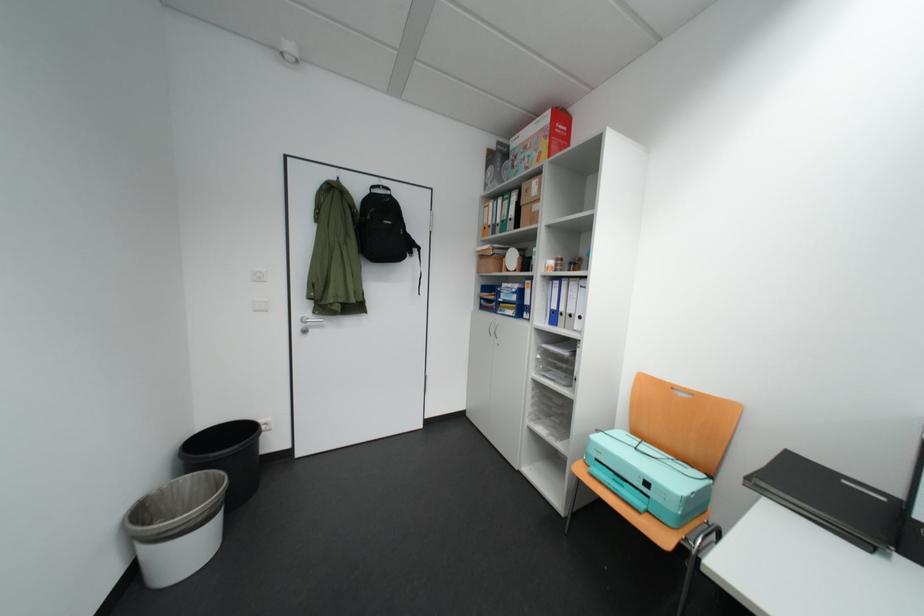
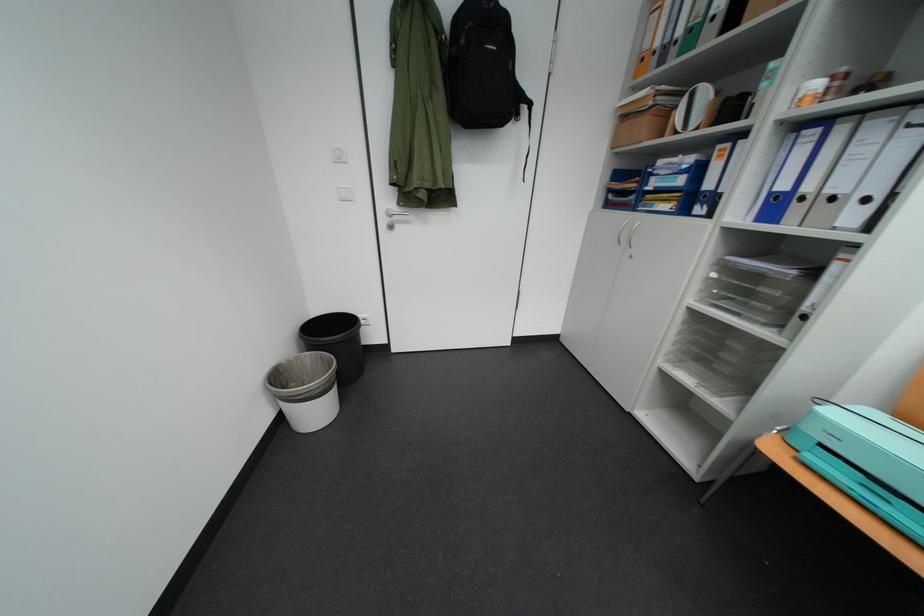
Where in the second image is the point corresponding to pixel 201 556 from the first image?

(329, 415)